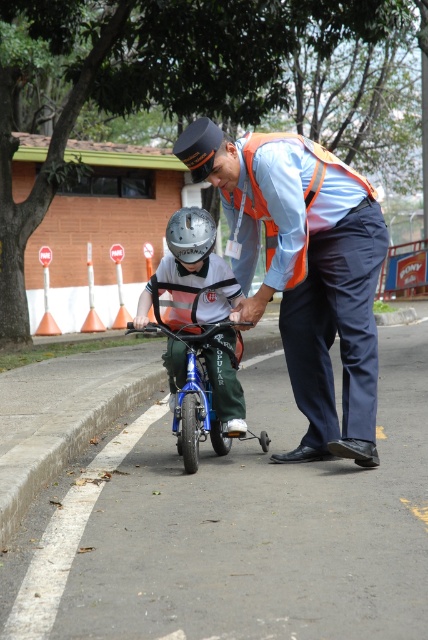
Question: Among these objects, which one is nearest to the camera?

Choices:
 (A) orange reflective safety vest at center
 (B) metallic helmet at center

Answer: (A)

Question: Can you confirm if orange reflective safety vest at center is positioned to the left of metallic helmet at center?

Choices:
 (A) yes
 (B) no

Answer: (B)

Question: Which object is the farthest from the orange reflective safety vest at center?

Choices:
 (A) orange reflective vest at center
 (B) blue metallic bicycle at center
 (C) white matte helmet at center

Answer: (B)

Question: Does blue metallic bicycle at center come in front of white matte helmet at center?

Choices:
 (A) no
 (B) yes

Answer: (B)

Question: Which point is closer to the camera?

Choices:
 (A) (255, 300)
 (B) (269, 218)
 (C) (177, 337)

Answer: (A)

Question: Does orange reflective safety vest at center appear on the right side of blue metallic bicycle at center?

Choices:
 (A) no
 (B) yes

Answer: (B)